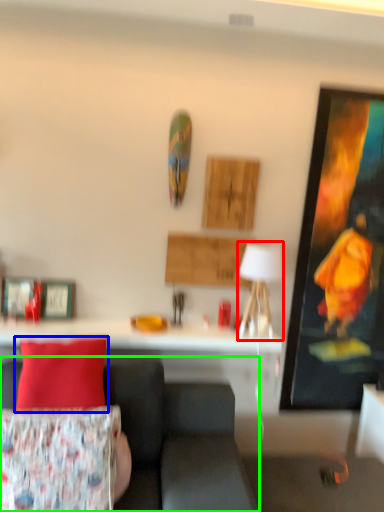
Question: Based on their relative distances, which object is farther from table lamp (highlighted by a red box)? Choose from pillow (highlighted by a blue box) and studio couch (highlighted by a green box).

Choices:
 (A) pillow
 (B) studio couch

Answer: (A)